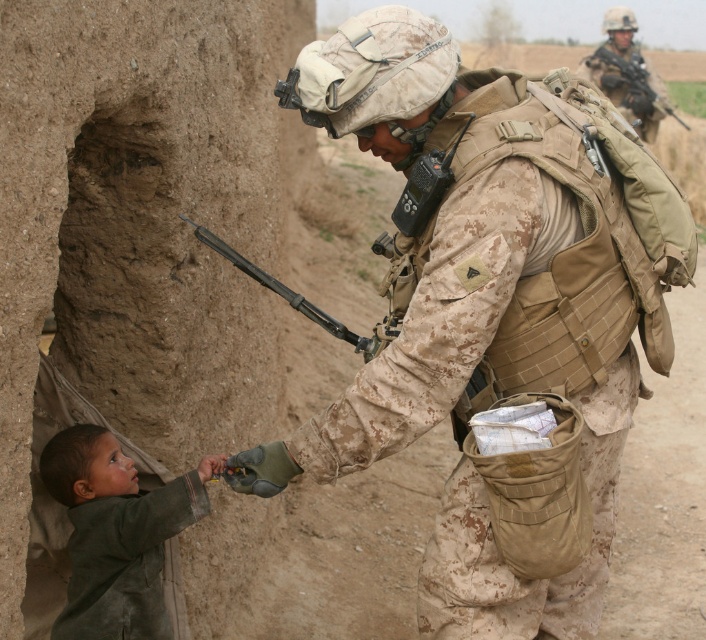
Question: Which of the following is the farthest from the observer?

Choices:
 (A) camouflage uniform at center
 (B) dark green fabric at lower left
 (C) camouflage uniform at upper right

Answer: (C)

Question: Which of the following is the closest to the observer?

Choices:
 (A) (525, 285)
 (B) (618, 42)
 (C) (85, 440)

Answer: (A)

Question: Which is farther from the dark green fabric at lower left?

Choices:
 (A) camouflage uniform at center
 (B) camouflage uniform at upper right

Answer: (B)

Question: Does dark green fabric at lower left appear on the left side of camouflage uniform at upper right?

Choices:
 (A) yes
 (B) no

Answer: (A)

Question: Observing the image, what is the correct spatial positioning of dark green fabric at lower left in reference to camouflage uniform at upper right?

Choices:
 (A) below
 (B) above

Answer: (A)

Question: Does camouflage uniform at center lie behind camouflage uniform at upper right?

Choices:
 (A) yes
 (B) no

Answer: (B)